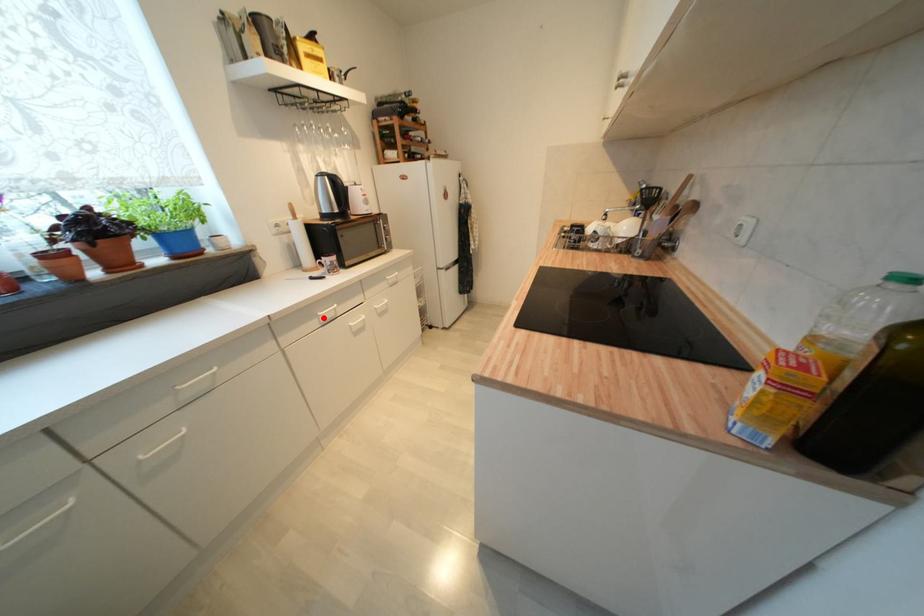
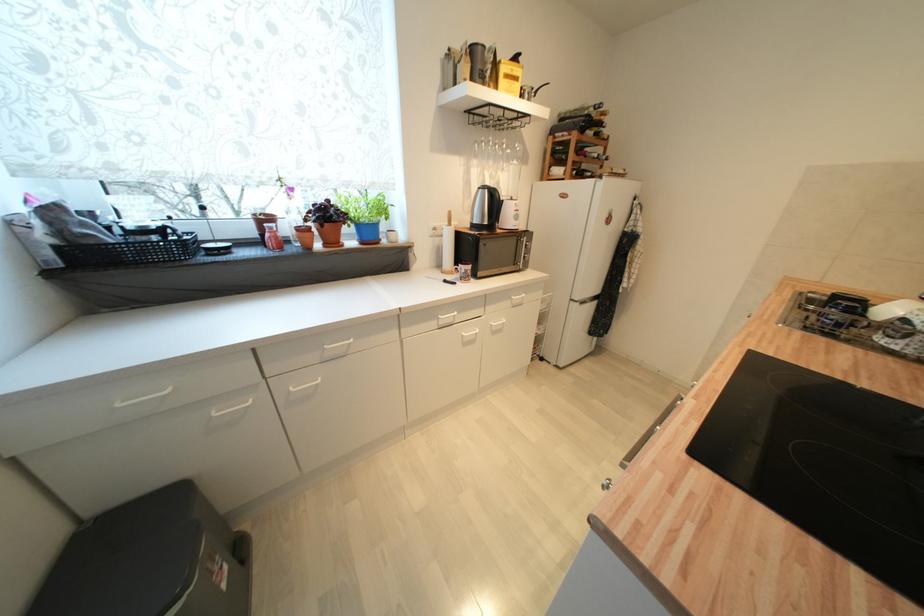
Question: I am providing you with two images of the same scene from different viewpoints. Image1 has a red point marked. In image2, the corresponding 3D location appears at what relative position? Reply with the corresponding letter.

Choices:
 (A) Closer
 (B) Farther

Answer: (B)